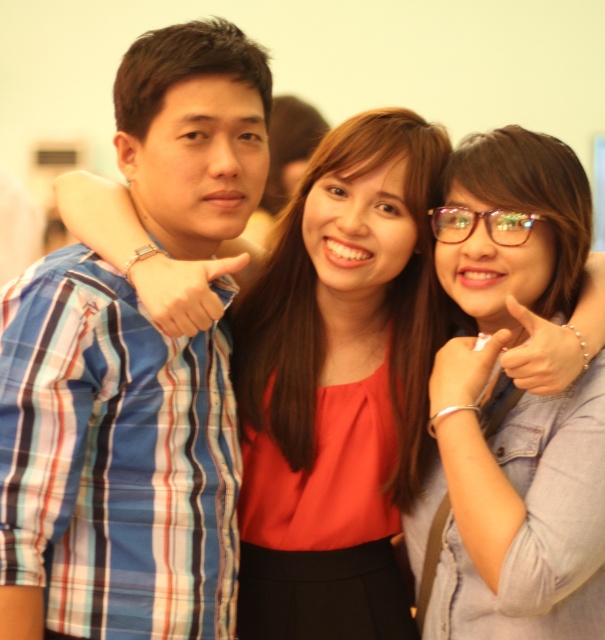
Question: Which object is closer to the camera taking this photo?

Choices:
 (A) blue plaid shirt at left
 (B) denim jacket at center

Answer: (A)

Question: Considering the relative positions of blue plaid shirt at left and denim jacket at center in the image provided, where is blue plaid shirt at left located with respect to denim jacket at center?

Choices:
 (A) above
 (B) below

Answer: (A)

Question: Is matte silver bracelet at center bigger than transparent plastic glasses at center?

Choices:
 (A) no
 (B) yes

Answer: (B)

Question: Does pearl bracelet at upper center have a lesser width compared to matte blue plaid shirt at center?

Choices:
 (A) no
 (B) yes

Answer: (B)

Question: Among these objects, which one is nearest to the camera?

Choices:
 (A) transparent plastic glasses at center
 (B) matte silver bracelet at center

Answer: (B)

Question: Which object is the farthest from the pearl bracelet at upper center?

Choices:
 (A) blue plaid shirt at left
 (B) matte blue plaid shirt at center
 (C) matte silver bracelet at center
 (D) transparent plastic glasses at center

Answer: (A)